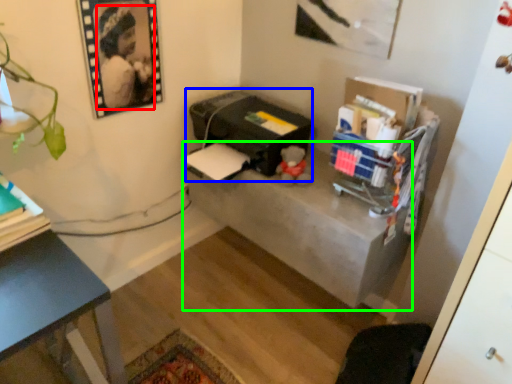
Question: Which object is positioned closest to person (highlighted by a red box)? Select from printer (highlighted by a blue box) and table (highlighted by a green box).

Choices:
 (A) printer
 (B) table

Answer: (A)